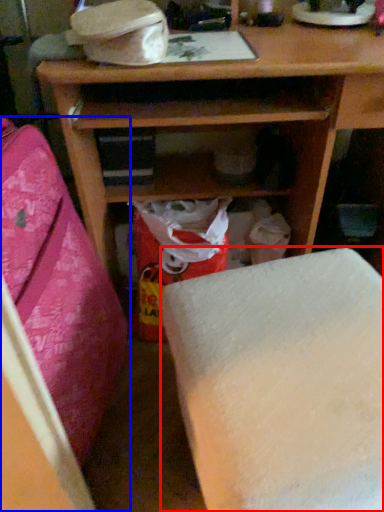
Question: Which of the following is the closest to the observer, furniture (highlighted by a red box) or furniture (highlighted by a blue box)?

Choices:
 (A) furniture
 (B) furniture

Answer: (B)